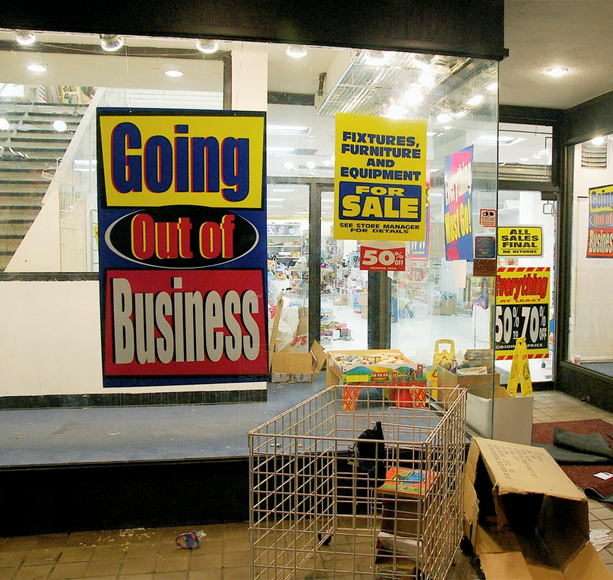
The height and width of the screenshot is (580, 613). In order to click on mat in this screenshot , I will do `click(584, 470)`.